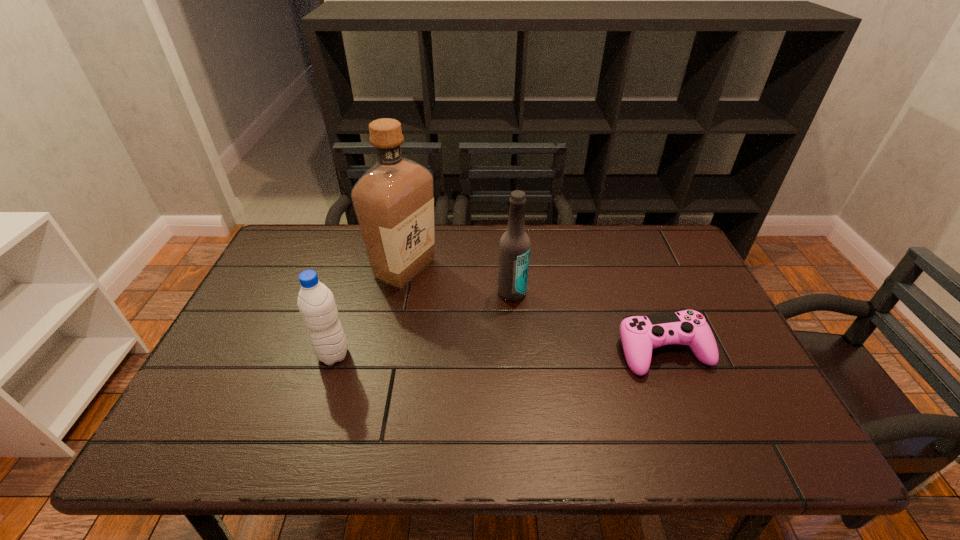
This screenshot has width=960, height=540. What are the coordinates of `vacant area that lies between the third object from left to right and the shortest object` in the screenshot? It's located at (588, 322).

You are a GUI agent. You are given a task and a screenshot of the screen. Output one action in this format:
    pyautogui.click(x=<x>, y=<y>)
    Task: Click on the vacant space that is in between the water bottle and the tallest object
    The width and height of the screenshot is (960, 540).
    Given the screenshot: What is the action you would take?
    pyautogui.click(x=369, y=312)

You are a GUI agent. You are given a task and a screenshot of the screen. Output one action in this format:
    pyautogui.click(x=<x>, y=<y>)
    Task: Click on the unoccupied position between the third shortest object and the shortest object
    
    Given the screenshot: What is the action you would take?
    pyautogui.click(x=588, y=322)

Identify which object is the second closest to the second object from right to left. Please provide its 2D coordinates. Your answer should be formatted as a tuple, i.e. [(x, y)], where the tuple contains the x and y coordinates of a point satisfying the conditions above.

[(640, 334)]

Where is `the closest object to the liquor`? This screenshot has height=540, width=960. the closest object to the liquor is located at coordinates (514, 247).

Find the location of a particular element. This screenshot has width=960, height=540. vacant region that satisfies the following two spatial constraints: 1. on the back side of the third tallest object; 2. on the right side of the beer bottle is located at coordinates (353, 293).

This screenshot has width=960, height=540. What are the coordinates of `free space that satisfies the following two spatial constraints: 1. on the front side of the beer bottle; 2. on the left side of the liquor` in the screenshot? It's located at [400, 293].